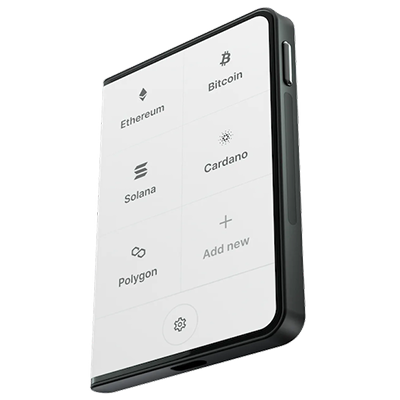
The width and height of the screenshot is (400, 400). I want to click on boxes, so click(157, 85), click(197, 62), click(199, 160), click(155, 160), click(156, 243), click(194, 230).